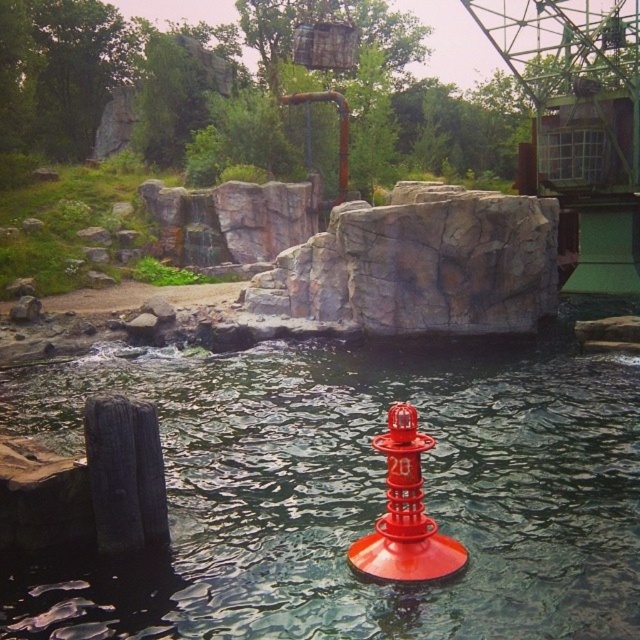
You are a zookeeper planning to place a new sign near the water. The sign must be placed where it can be seen clearly from both the glossy plastic water at center and the red matte buoy at center. Considering their sizes, which object should the sign be closer to?

The glossy plastic water at center is larger than the red matte buoy at center, so the sign should be placed closer to the red matte buoy at center to ensure visibility from both locations.

You are standing at the point with coordinates point [410,566] and want to walk towards the point with coordinates point [403,396]. Will you be moving forward or backward relative to your current position?

Since point [403,396] is behind point [410,566], moving towards it would mean you are moving backward relative to your current position at point [410,566].